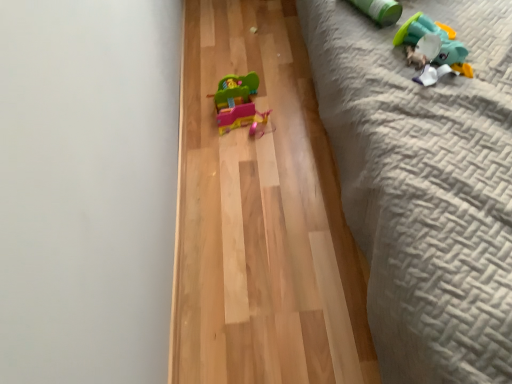
Question: Is light brown wood flooring at center not within textured gray quilt at right?

Choices:
 (A) yes
 (B) no

Answer: (A)

Question: Would you say light brown wood flooring at center is a long distance from textured gray quilt at right?

Choices:
 (A) no
 (B) yes

Answer: (A)

Question: From a real-world perspective, is light brown wood flooring at center under textured gray quilt at right?

Choices:
 (A) yes
 (B) no

Answer: (A)

Question: Does light brown wood flooring at center have a smaller size compared to textured gray quilt at right?

Choices:
 (A) no
 (B) yes

Answer: (B)

Question: Is textured gray quilt at right at the back of light brown wood flooring at center?

Choices:
 (A) no
 (B) yes

Answer: (A)

Question: Is plush green duck at upper right, placed as the 1th toy when sorted from right to left, taller or shorter than light brown wood flooring at center?

Choices:
 (A) tall
 (B) short

Answer: (A)

Question: Looking at the image, does plush green duck at upper right, which is the 3th toy in back-to-front order, seem bigger or smaller compared to light brown wood flooring at center?

Choices:
 (A) small
 (B) big

Answer: (A)

Question: From the image's perspective, is plush green duck at upper right, which is the 1th toy from front to back, located above or below light brown wood flooring at center?

Choices:
 (A) below
 (B) above

Answer: (B)

Question: From a real-world perspective, relative to light brown wood flooring at center, is plush green duck at upper right, which is the 1th toy from front to back, vertically above or below?

Choices:
 (A) above
 (B) below

Answer: (A)

Question: Based on their positions, is light brown wood flooring at center located to the left or right of green matte cylinder at upper right, placed as the 2th toy when sorted from front to back?

Choices:
 (A) right
 (B) left

Answer: (B)

Question: Looking at their shapes, would you say light brown wood flooring at center is wider or thinner than green matte cylinder at upper right, which is the 2th toy in right-to-left order?

Choices:
 (A) wide
 (B) thin

Answer: (A)

Question: Considering the positions of point (186, 57) and point (354, 3), is point (186, 57) closer or farther from the camera than point (354, 3)?

Choices:
 (A) closer
 (B) farther

Answer: (B)

Question: Considering the positions of light brown wood flooring at center and green matte cylinder at upper right, which is the 2th toy in right-to-left order, in the image, is light brown wood flooring at center taller or shorter than green matte cylinder at upper right, which is the 2th toy in right-to-left order,?

Choices:
 (A) short
 (B) tall

Answer: (A)

Question: Considering the positions of point (249, 87) and point (506, 4), is point (249, 87) closer or farther from the camera than point (506, 4)?

Choices:
 (A) closer
 (B) farther

Answer: (B)

Question: Based on their positions, is matte plastic toy at center, acting as the first toy starting from the left, located to the left or right of textured gray quilt at right?

Choices:
 (A) left
 (B) right

Answer: (A)